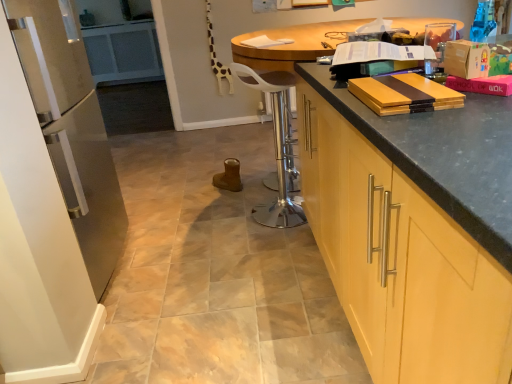
Question: From the image's perspective, is metallic silver bar stool at center on matte black countertop at right?

Choices:
 (A) yes
 (B) no

Answer: (B)

Question: Does metallic silver bar stool at center turn towards matte black countertop at right?

Choices:
 (A) yes
 (B) no

Answer: (A)

Question: Can you confirm if metallic silver bar stool at center is positioned to the left of matte black countertop at right?

Choices:
 (A) yes
 (B) no

Answer: (A)

Question: From a real-world perspective, does metallic silver bar stool at center stand above matte black countertop at right?

Choices:
 (A) yes
 (B) no

Answer: (B)

Question: From a real-world perspective, is metallic silver bar stool at center beneath matte black countertop at right?

Choices:
 (A) no
 (B) yes

Answer: (B)

Question: Is metallic silver bar stool at center directly adjacent to matte black countertop at right?

Choices:
 (A) yes
 (B) no

Answer: (B)

Question: Are matte yellow wood book at upper right, arranged as the 3th book when viewed from the front, and yellow wood cutting board at upper right, which is the first book from bottom to top, located far from each other?

Choices:
 (A) yes
 (B) no

Answer: (B)

Question: Is matte yellow wood book at upper right, which appears as the 2th book when viewed from the back, turned away from yellow wood cutting board at upper right, the fourth book from the back?

Choices:
 (A) no
 (B) yes

Answer: (A)

Question: Does matte yellow wood book at upper right, the 3th book in the bottom-to-top sequence, have a lesser height compared to yellow wood cutting board at upper right, the fourth book from the back?

Choices:
 (A) yes
 (B) no

Answer: (B)

Question: Is matte yellow wood book at upper right, the 3th book in the bottom-to-top sequence, aimed at yellow wood cutting board at upper right, which is the first book from bottom to top?

Choices:
 (A) no
 (B) yes

Answer: (A)

Question: Is matte yellow wood book at upper right, which ranks as the 2th book in top-to-bottom order, closer to camera compared to yellow wood cutting board at upper right, the fourth book from the back?

Choices:
 (A) no
 (B) yes

Answer: (A)

Question: Considering the relative sizes of matte yellow wood book at upper right, the 3th book in the bottom-to-top sequence, and yellow wood cutting board at upper right, the fourth book from the back, in the image provided, is matte yellow wood book at upper right, the 3th book in the bottom-to-top sequence, smaller than yellow wood cutting board at upper right, the fourth book from the back,?

Choices:
 (A) yes
 (B) no

Answer: (B)

Question: Considering the relative sizes of matte yellow wood book at upper right, the 3th book in the bottom-to-top sequence, and white glossy refrigerator at left in the image provided, is matte yellow wood book at upper right, the 3th book in the bottom-to-top sequence, taller than white glossy refrigerator at left?

Choices:
 (A) yes
 (B) no

Answer: (B)